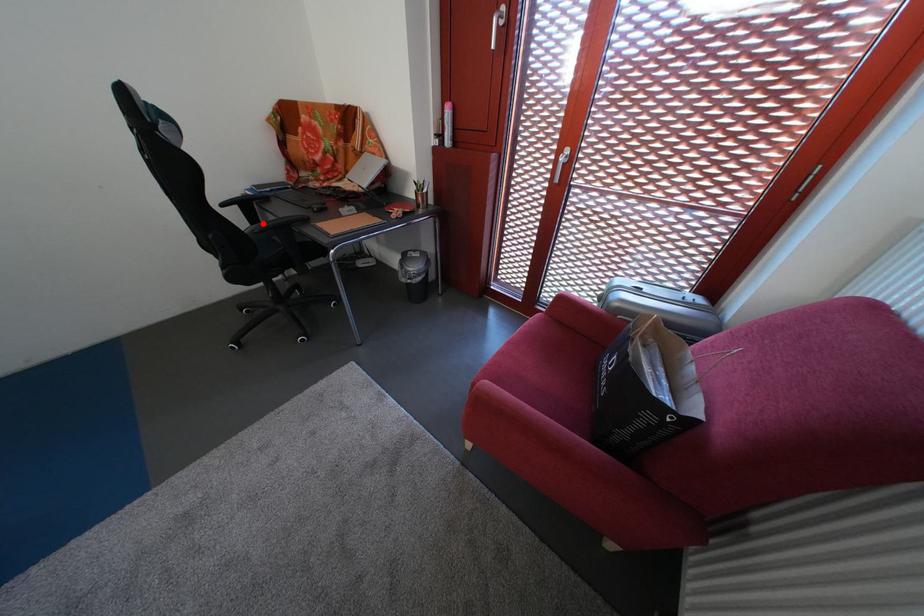
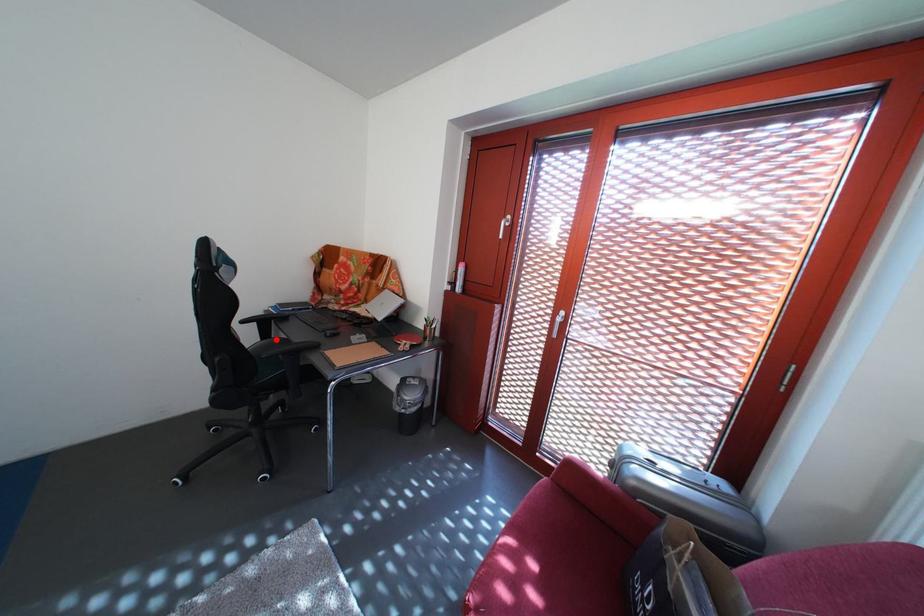
I am providing you with two images of the same scene from different viewpoints. A red point is marked on the first image and another point is marked on the second image. Do the highlighted points in image1 and image2 indicate the same real-world spot?

Yes